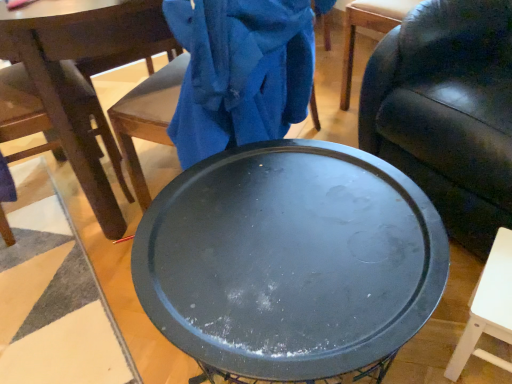
What do you see at coordinates (488, 308) in the screenshot? The image size is (512, 384). I see `matte black tray at center` at bounding box center [488, 308].

Looking at this image, what is the approximate height of dark brown wood chair at left, which is the second chair from right to left?

It is 30.32 inches.

This screenshot has height=384, width=512. Identify the location of black matte round table at center. (290, 262).

Would you consider dark brown wood chair at left, which is the second chair from right to left, to be distant from black matte round table at center?

They are positioned close to each other.

Identify the location of chair that is the 1st one when counting upward from the black matte round table at center (from the image's perspective). 81,80.

Does dark brown wood chair at left, the 1th chair from the left, turn towards black matte round table at center?

No, dark brown wood chair at left, the 1th chair from the left, is not oriented towards black matte round table at center.

Which of these two, dark brown wood chair at left, which is the second chair from right to left, or matte black tray at center, is smaller?

With smaller size is matte black tray at center.

Is dark brown wood chair at left, the 1th chair from the left, to the left of matte black tray at center from the viewer's perspective?

Correct, you'll find dark brown wood chair at left, the 1th chair from the left, to the left of matte black tray at center.

Is dark brown wood chair at left, the 1th chair from the left, positioned behind matte black tray at center?

Yes, dark brown wood chair at left, the 1th chair from the left, is further from the camera.

Does point (100, 66) come farther from viewer compared to point (483, 317)?

Yes.

Does matte black tray at center have a smaller size compared to black matte round table at center?

Indeed, matte black tray at center has a smaller size compared to black matte round table at center.

From the image's perspective, is matte black tray at center located above or below black matte round table at center?

Based on their image positions, matte black tray at center is located above black matte round table at center.

Considering the positions of points (509, 328) and (224, 290), is point (509, 328) farther from camera compared to point (224, 290)?

Yes, it is.

The image size is (512, 384). I want to click on table beneath the leather couch at center, the 2th chair when ordered from left to right (from a real-world perspective), so click(488, 308).

Does matte black tray at center have a lesser width compared to leather couch at center, the 1th chair when ordered from right to left?

Yes, matte black tray at center is thinner than leather couch at center, the 1th chair when ordered from right to left.

Based on the photo, is matte black tray at center inside the boundaries of leather couch at center, the 2th chair when ordered from left to right, or outside?

matte black tray at center is outside leather couch at center, the 2th chair when ordered from left to right.

Can you see matte black tray at center touching leather couch at center, the 1th chair when ordered from right to left?

No, matte black tray at center is not next to leather couch at center, the 1th chair when ordered from right to left.

Is leather couch at center, the 1th chair when ordered from right to left, oriented towards black matte round table at center?

Yes, leather couch at center, the 1th chair when ordered from right to left, is oriented towards black matte round table at center.

Is leather couch at center, the 1th chair when ordered from right to left, directly adjacent to black matte round table at center?

leather couch at center, the 1th chair when ordered from right to left, is not next to black matte round table at center, and they're not touching.

What's the angular difference between leather couch at center, the 2th chair when ordered from left to right, and black matte round table at center's facing directions?

The angular difference between leather couch at center, the 2th chair when ordered from left to right, and black matte round table at center is 1.23 degrees.

Consider the image. From the image's perspective, is leather couch at center, the 1th chair when ordered from right to left, above black matte round table at center?

Correct, leather couch at center, the 1th chair when ordered from right to left, appears higher than black matte round table at center in the image.

Is dark brown wood chair at left, the 1th chair from the left, inside leather couch at center, the 1th chair when ordered from right to left?

Definitely not — dark brown wood chair at left, the 1th chair from the left, is not inside leather couch at center, the 1th chair when ordered from right to left.

Is leather couch at center, the 2th chair when ordered from left to right, positioned before dark brown wood chair at left, which is the second chair from right to left?

Yes, leather couch at center, the 2th chair when ordered from left to right, is closer to the camera.

Considering the sizes of leather couch at center, the 2th chair when ordered from left to right, and dark brown wood chair at left, which is the second chair from right to left, in the image, is leather couch at center, the 2th chair when ordered from left to right, wider or thinner than dark brown wood chair at left, which is the second chair from right to left,?

Clearly, leather couch at center, the 2th chair when ordered from left to right, has more width compared to dark brown wood chair at left, which is the second chair from right to left.

From the image's perspective, which object appears higher, leather couch at center, the 1th chair when ordered from right to left, or dark brown wood chair at left, which is the second chair from right to left?

leather couch at center, the 1th chair when ordered from right to left, from the image's perspective.

Is black matte round table at center at the left side of matte black tray at center?

Yes.

What are the coordinates of `round table below the matte black tray at center (from a real-world perspective)` in the screenshot? It's located at (290, 262).

From the picture: Can you tell me how much black matte round table at center and matte black tray at center differ in facing direction?

69.7 degrees.

Is point (186, 238) closer to camera compared to point (446, 369)?

Yes, point (186, 238) is in front of point (446, 369).

Image resolution: width=512 pixels, height=384 pixels. I want to click on the 2nd chair behind the black matte round table at center, counting from the anchor's position, so click(81, 80).

At what (x,y) coordinates should I click in order to perform the action: click on table that appears below the dark brown wood chair at left, the 1th chair from the left (from a real-world perspective). Please return your answer as a coordinate pair (x, y). Looking at the image, I should click on (488, 308).

When comparing their distances from leather couch at center, the 2th chair when ordered from left to right, does matte black tray at center or black matte round table at center seem closer?

matte black tray at center is positioned closer to the anchor leather couch at center, the 2th chair when ordered from left to right.

Looking at the image, which one is located closer to dark brown wood chair at left, the 1th chair from the left, black matte round table at center or matte black tray at center?

black matte round table at center is positioned closer to the anchor dark brown wood chair at left, the 1th chair from the left.

From the image, which object appears to be farther from leather couch at center, the 1th chair when ordered from right to left, black matte round table at center or matte black tray at center?

black matte round table at center is further to leather couch at center, the 1th chair when ordered from right to left.

Looking at this image, based on their spatial positions, is matte black tray at center or dark brown wood chair at left, the 1th chair from the left, further from black matte round table at center?

dark brown wood chair at left, the 1th chair from the left, is further to black matte round table at center.

Considering their positions, is dark brown wood chair at left, which is the second chair from right to left, positioned closer to black matte round table at center than matte black tray at center?

matte black tray at center.

From the image, which object appears to be nearer to dark brown wood chair at left, the 1th chair from the left, matte black tray at center or black matte round table at center?

black matte round table at center.

Looking at the image, which one is located closer to leather couch at center, the 1th chair when ordered from right to left, black matte round table at center or dark brown wood chair at left, which is the second chair from right to left?

black matte round table at center is positioned closer to the anchor leather couch at center, the 1th chair when ordered from right to left.

Consider the image. Which object lies further to the anchor point black matte round table at center, leather couch at center, the 2th chair when ordered from left to right, or dark brown wood chair at left, which is the second chair from right to left?

dark brown wood chair at left, which is the second chair from right to left, lies further to black matte round table at center than the other object.

Identify the location of table between black matte round table at center and leather couch at center, the 1th chair when ordered from right to left, in the horizontal direction. (488, 308).

Locate an element on the screen. table situated between dark brown wood chair at left, the 1th chair from the left, and leather couch at center, the 1th chair when ordered from right to left, from left to right is located at coordinates (488, 308).

Identify the location of round table between dark brown wood chair at left, the 1th chair from the left, and leather couch at center, the 1th chair when ordered from right to left, in the horizontal direction. (290, 262).

The height and width of the screenshot is (384, 512). Identify the location of round table situated between dark brown wood chair at left, which is the second chair from right to left, and matte black tray at center from left to right. (290, 262).